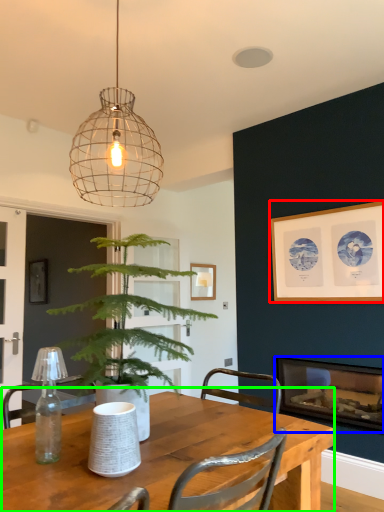
Question: Based on their relative distances, which object is farther from picture frame (highlighted by a red box)? Choose from fireplace (highlighted by a blue box) and table (highlighted by a green box).

Choices:
 (A) fireplace
 (B) table

Answer: (B)